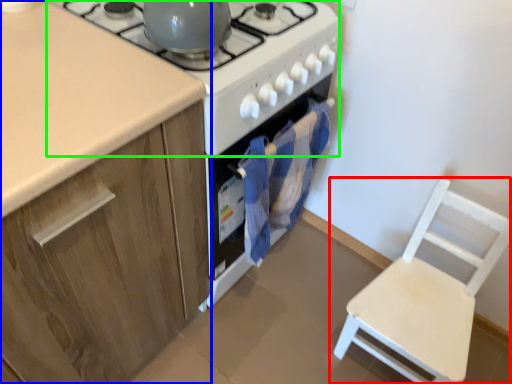
Question: Based on their relative distances, which object is nearer to chair (highlighted by a red box)? Choose from cabinetry (highlighted by a blue box) and gas stove (highlighted by a green box).

Choices:
 (A) cabinetry
 (B) gas stove

Answer: (B)